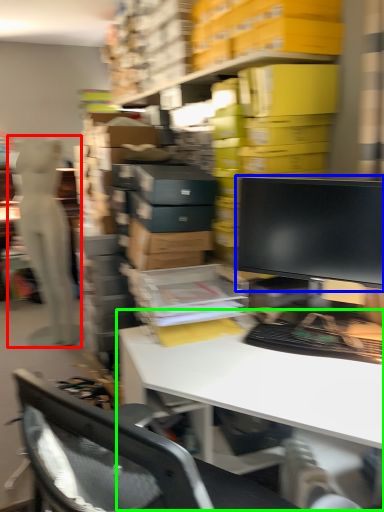
Question: Considering the real-world distances, which object is farthest from person (highlighted by a red box)? computer monitor (highlighted by a blue box) or desk (highlighted by a green box)?

Choices:
 (A) computer monitor
 (B) desk

Answer: (A)